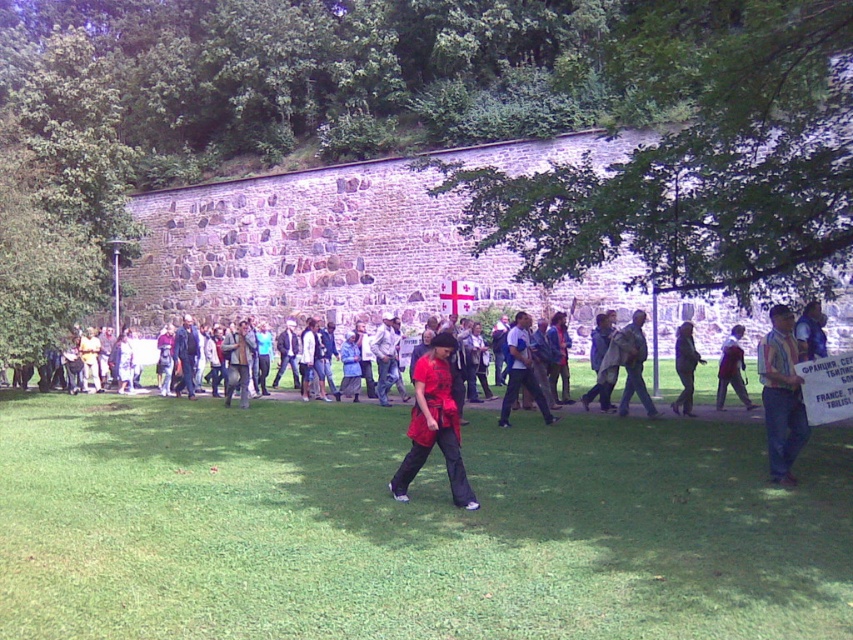
You are a photographer standing at the back of the crowd. You want to take a photo of the red fabric jacket at center and the dark blue jeans at center so that both are clearly visible. Given that your camera has a minimum focus distance of 35 inches, will you need to step forward or backward to ensure both subjects are in focus?

The distance between the red fabric jacket at center and dark blue jeans at center is 34.72 inches, which is less than the camera minimum focus distance of 35 inches. Therefore, you need to step forward to reduce the distance between you and the subjects so that the camera can focus on both.

Based on the photo, you are a photographer trying to capture a candid shot of the striped shirt at center and the dark blue jeans at center. Based on their positions, which clothing item is positioned lower in the photo?

The striped shirt at center is located below dark blue jeans at center, so the striped shirt at center is positioned lower in the photo.

You are standing in the grassy area near the stone wall and want to move from point A to point B. Point A is located at coordinates point (721, 378) and point B is at point (688, 397). Which point is closer to you?

Point A at point (721, 378) is closer to you because it is further to the viewer than point B at point (688, 397).